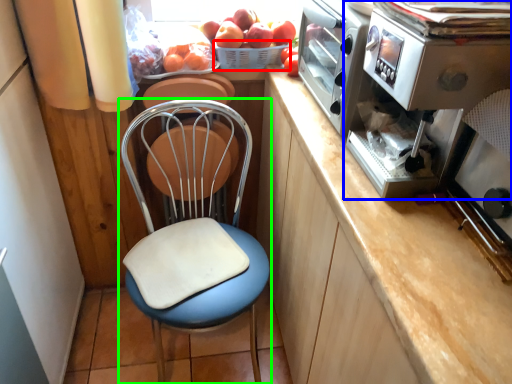
Question: Based on their relative distances, which object is nearer to basket (highlighted by a red box)? Choose from kitchen appliance (highlighted by a blue box) and chair (highlighted by a green box).

Choices:
 (A) kitchen appliance
 (B) chair

Answer: (B)